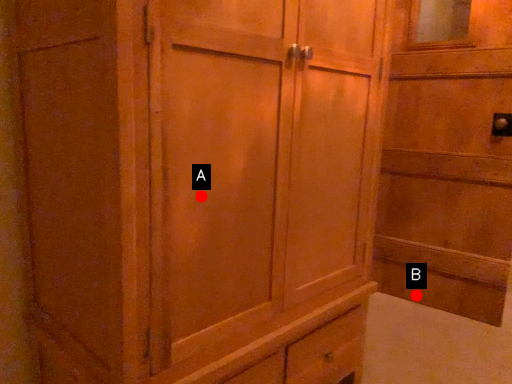
Question: Two points are circled on the image, labeled by A and B beside each circle. Which of the following is the closest to the observer?

Choices:
 (A) A is closer
 (B) B is closer

Answer: (A)